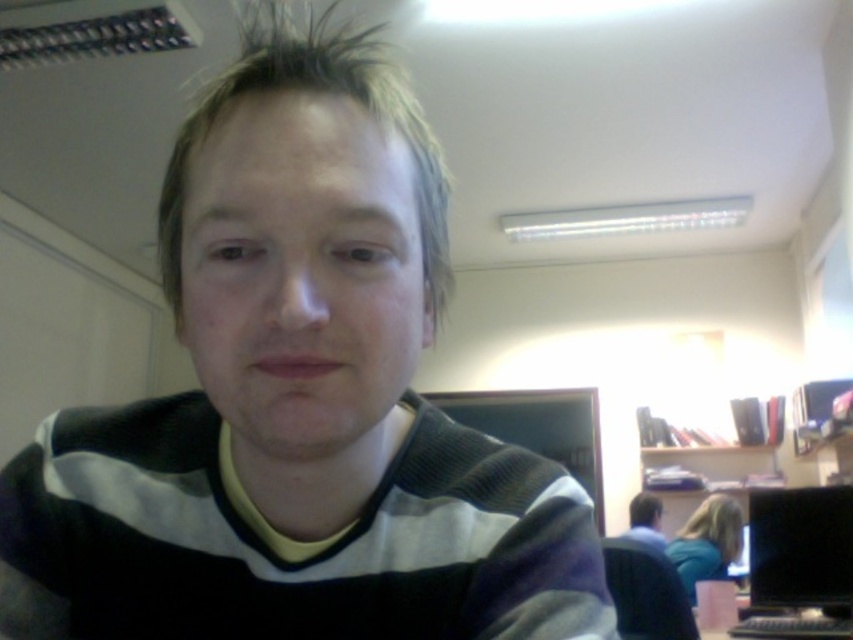
You are standing in the room and see two points marked on the wall. The first is at point [396,509] and the second is at point [770,497]. Which point is closer to you?

Point [396,509] is in front of point [770,497], so it is closer to you.

You are organizing a photo shoot and need to ensure that the black striped sweater at center and the black glossy monitor at right are both visible in the frame. Given their sizes, which object should you prioritize positioning closer to the camera to maintain clarity?

The black striped sweater at center is wider than the black glossy monitor at right, so you should prioritize positioning the black striped sweater at center closer to the camera to maintain clarity.